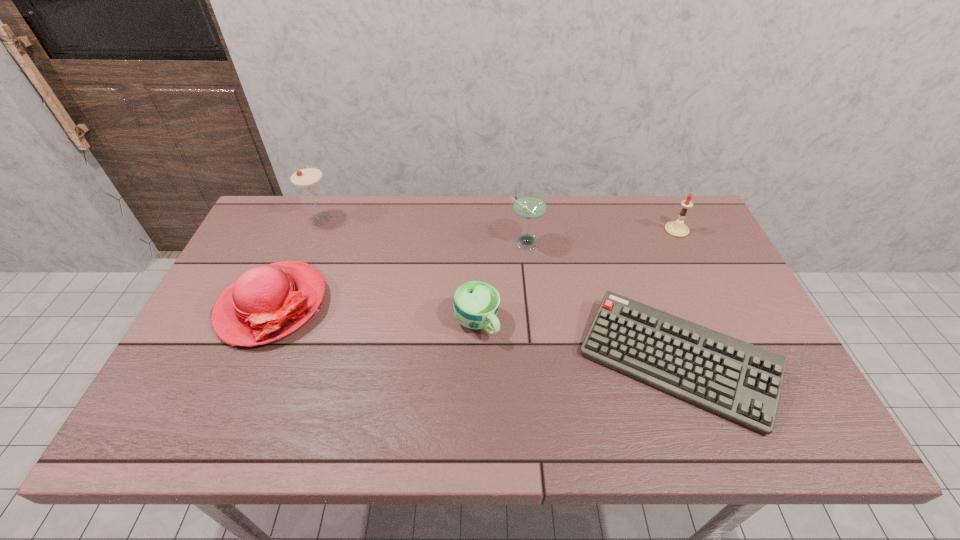
This screenshot has height=540, width=960. In order to click on empty space between the shortest object and the nearer martini in this screenshot , I will do `click(601, 303)`.

At what (x,y) coordinates should I click in order to perform the action: click on free space between the right martini and the third shortest object. Please return your answer as a coordinate pair (x, y). Looking at the image, I should click on (398, 274).

The width and height of the screenshot is (960, 540). In order to click on vacant space in between the left martini and the second shortest object in this screenshot , I will do `click(398, 271)`.

Locate an element on the screen. free space that is in between the farther martini and the candle is located at coordinates (498, 224).

Locate an element on the screen. vacant space that's between the shortest object and the farther martini is located at coordinates (498, 291).

I want to click on vacant area that lies between the third shortest object and the cup, so click(x=374, y=314).

Where is `object that stands as the second closest to the left martini`? The image size is (960, 540). object that stands as the second closest to the left martini is located at coordinates (476, 303).

Image resolution: width=960 pixels, height=540 pixels. Find the location of `object that stands as the second closest to the candle`. object that stands as the second closest to the candle is located at coordinates (529, 205).

Identify the location of free space that satisfies the following two spatial constraints: 1. on the back side of the fifth tallest object; 2. on the left side of the fourth object from left to right. (477, 243).

Identify the location of vacant space that satisfies the following two spatial constraints: 1. on the front side of the farther martini; 2. on the left side of the third object from left to right. The height and width of the screenshot is (540, 960). (278, 322).